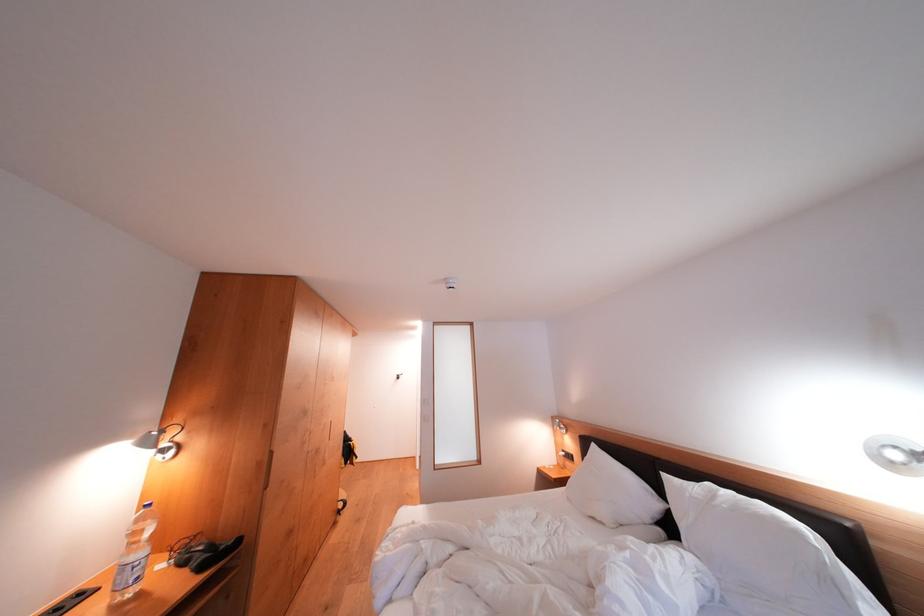
The height and width of the screenshot is (616, 924). What do you see at coordinates (317, 436) in the screenshot?
I see `the black cabinet handle` at bounding box center [317, 436].